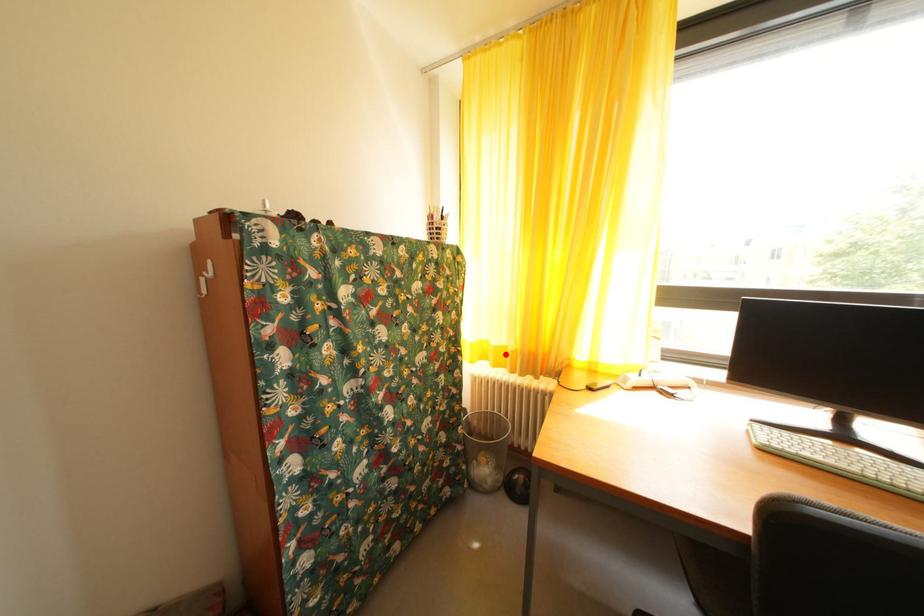
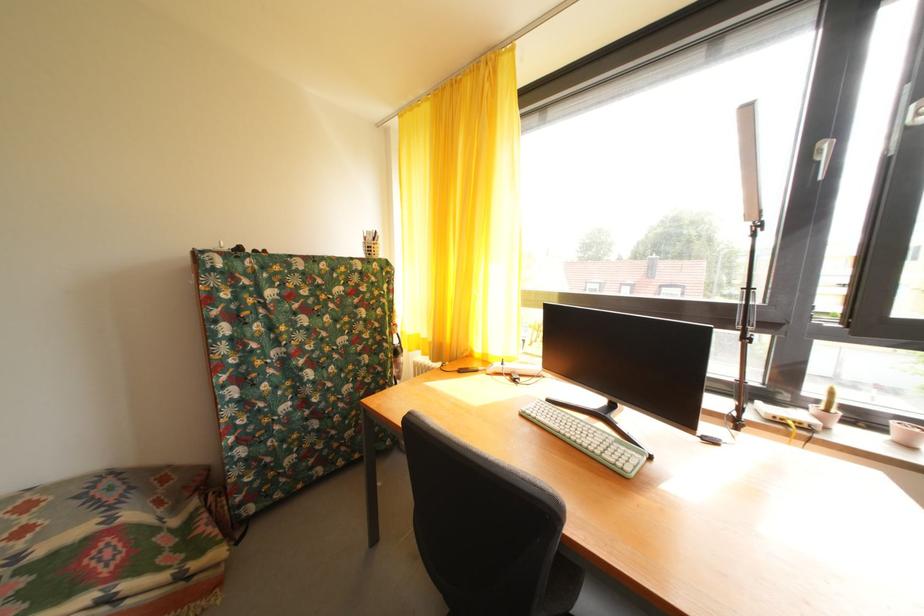
Find the pixel in the second image that matches the highlighted location in the first image.

(432, 346)